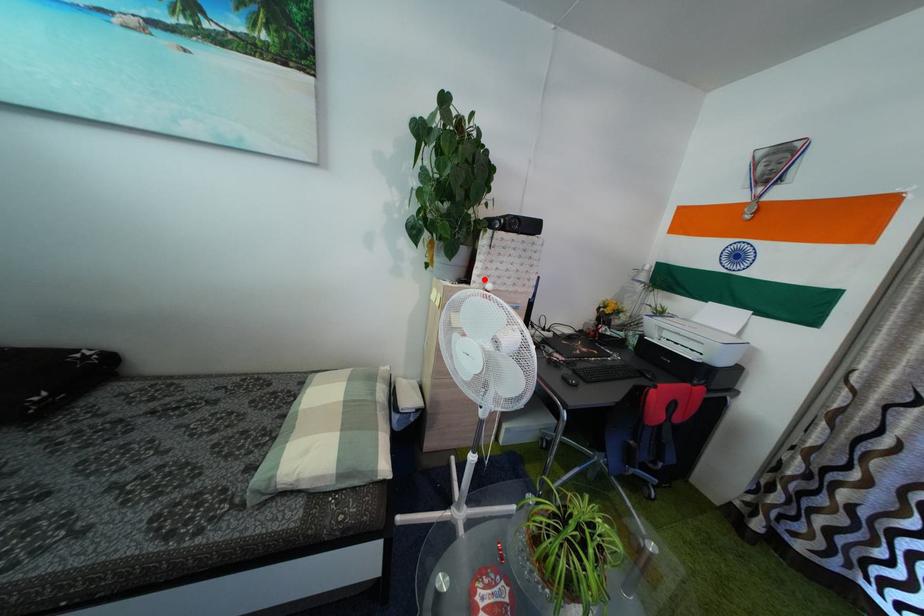
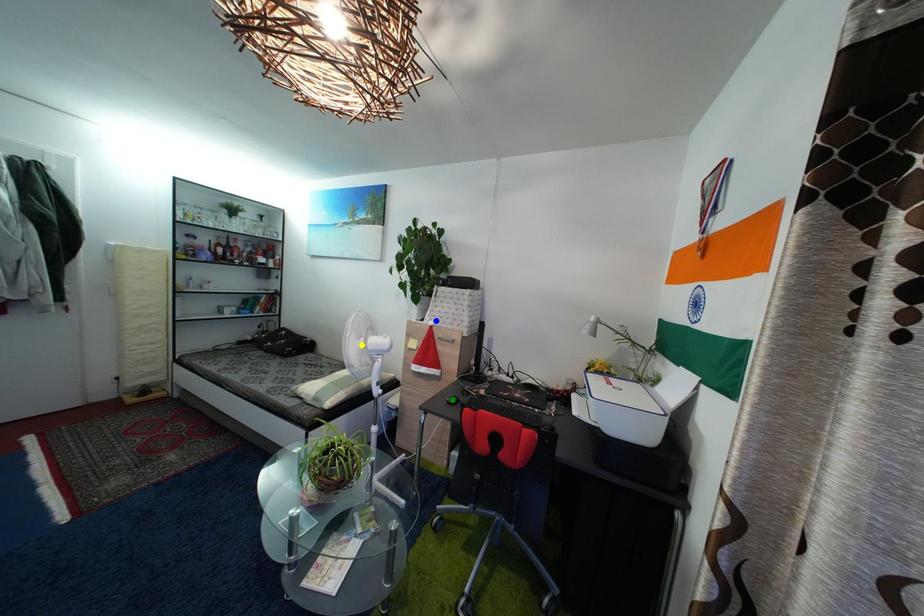
Question: I am providing you with two images of the same scene from different viewpoints. A red point is marked on the first image. You are given multiple points on the second image. Which spot in image 2 lines up with the point in image 1?

Choices:
 (A) green point
 (B) yellow point
 (C) blue point

Answer: (C)